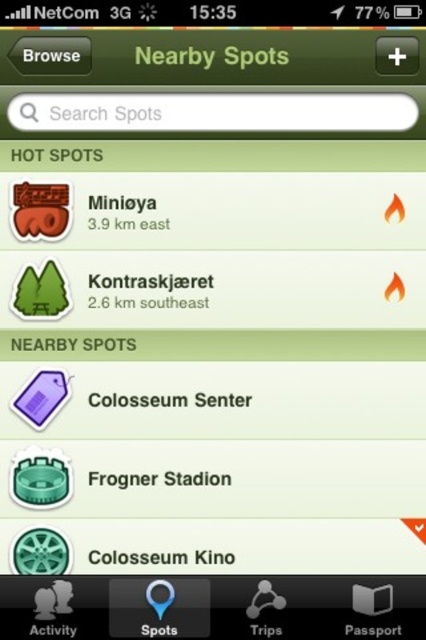
Based on the photo, you are using a navigation app and see the white paper colosseum senter at center and the green matte text at center. Which one is positioned lower on the screen?

The white paper colosseum senter at center is positioned lower on the screen than the green matte text at center.

You are looking at the app interface and see both the black metallic text at center and the green matte text at center. Which one is positioned to the right side?

The black metallic text at center is positioned to the right of the green matte text at center.

You are using a navigation app and see the white paper colosseum senter at center and the green matte text at center. Which one takes up more space on the screen?

The green matte text at center takes up more space on the screen because it is larger than the white paper colosseum senter at center.